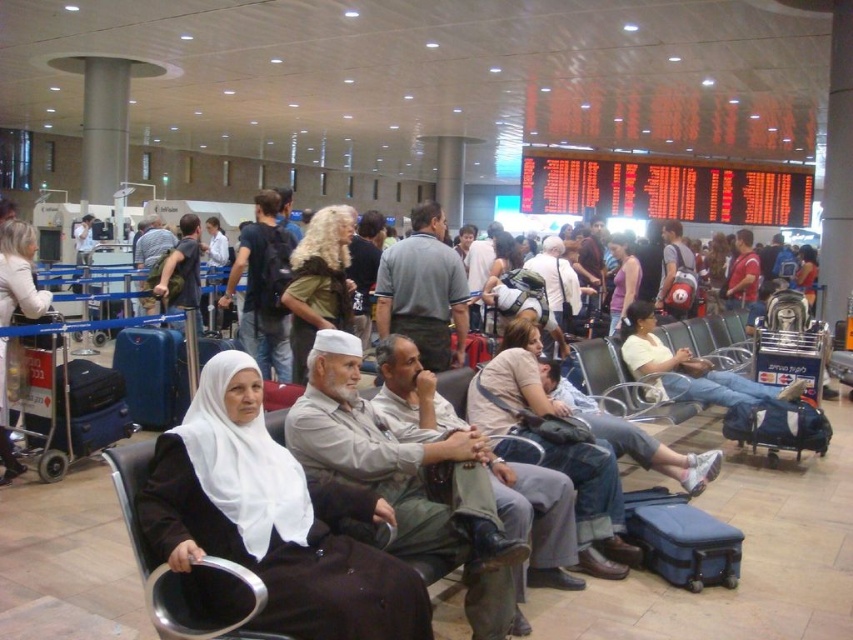
You are standing in the airport terminal and want to take a photo of both point (376, 449) and point (254, 602) in the scene. Which point should you focus on first to ensure both are in clear view?

You should focus on point (376, 449) first because it is closer to the camera than point (254, 602). By focusing on the closer point, both points will be in focus as the depth of field will cover the farther point.

You are a traveler who just arrived at the airport and need to locate your belongings. You see a blue hardshell suitcase at lower right and a purple matte shirt at center. Which object is nearer to you?

The blue hardshell suitcase at lower right is closer to the viewer than the purple matte shirt at center.

You are a passenger who just arrived at the airport terminal and need to place your blue hardshell suitcase at lower right near the seating area. According to the scene description, where exactly should you place it?

The blue hardshell suitcase at lower right should be placed at point (682, 540) as specified in the scene description.